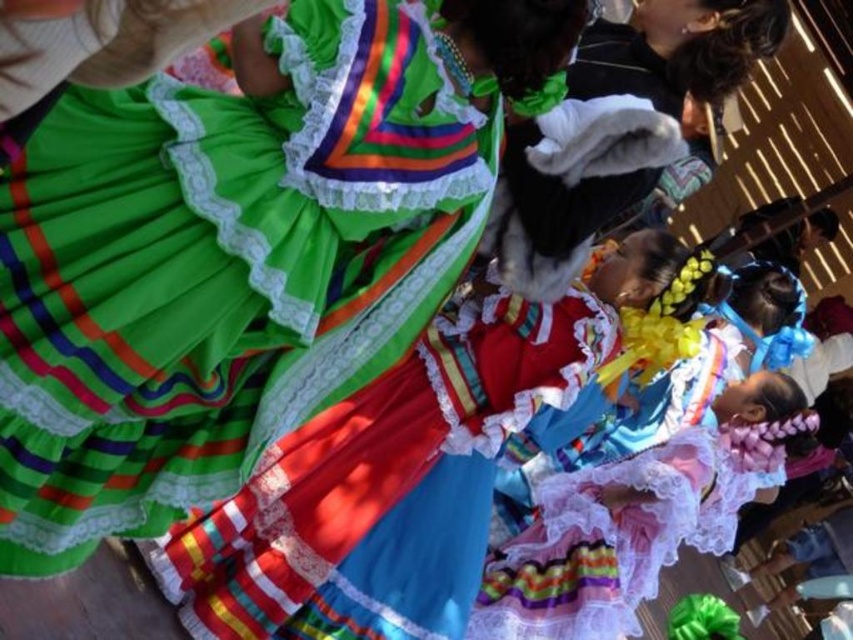
You are a photographer trying to capture a group photo of the pastel lace dress at center and the white fur hat at upper right. Based on their sizes, which object should you position closer to the camera to ensure both fit within the frame?

The pastel lace dress at center is wider than the white fur hat at upper right. To ensure both fit in the frame, position the wider pastel lace dress at center closer to the camera and the narrower white fur hat at upper right further back. This way, the dress will take up more space near the foreground, while the hat can be placed in the background without overcrowding the composition.

You are a photographer at the event and want to capture a closeup of the pastel lace dress at center. Given that your camera can focus on objects within a 0.5 unit radius from the point specified, will the focus point at (x=636, y=518) be sufficient to capture the dress?

The point (x=636, y=518) corresponds to the pastel lace dress at center, so yes, the focus point will be sufficient to capture the dress as it is directly aligned with the dress.

You are a photographer standing at the edge of the event area. You want to capture a photo of both the matte green fabric dress at center and the pastel lace dress at center in the same frame. Given that your camera has a maximum focal length of 50 meters, will you be able to take the photo without moving closer?

The matte green fabric dress at center and pastel lace dress at center are 10.20 meters apart. Since your camera can focus up to 50 meters, which is much greater than the distance between them, you can capture both in the same frame without moving closer.